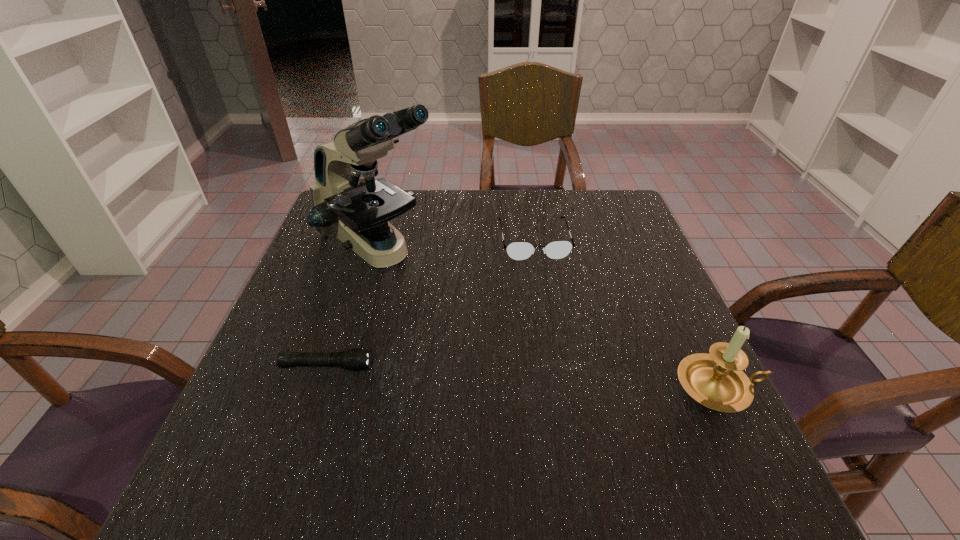
The width and height of the screenshot is (960, 540). Find the location of `free spot between the third tallest object and the microscope`. free spot between the third tallest object and the microscope is located at coordinates (455, 245).

Where is `vacant space in between the tallest object and the second shortest object`? vacant space in between the tallest object and the second shortest object is located at coordinates [455, 245].

I want to click on free space between the second shortest object and the microscope, so click(455, 245).

The width and height of the screenshot is (960, 540). Find the location of `free spot between the microscope and the second object from right to left`. free spot between the microscope and the second object from right to left is located at coordinates (455, 245).

Identify the location of unoccupied position between the third tallest object and the flashlight. (430, 303).

Identify the location of blank region between the microscope and the spectacles. The width and height of the screenshot is (960, 540). (455, 245).

At what (x,y) coordinates should I click in order to perform the action: click on empty space between the flashlight and the tallest object. Please return your answer as a coordinate pair (x, y). This screenshot has height=540, width=960. Looking at the image, I should click on (351, 308).

This screenshot has height=540, width=960. I want to click on free space between the spectacles and the tallest object, so click(x=455, y=245).

Find the location of a particular element. The height and width of the screenshot is (540, 960). object that is the third closest to the second object from right to left is located at coordinates (355, 359).

You are a GUI agent. You are given a task and a screenshot of the screen. Output one action in this format:
    pyautogui.click(x=<x>, y=<y>)
    Task: Click on the object that is the second closest to the rightmost object
    The width and height of the screenshot is (960, 540).
    Given the screenshot: What is the action you would take?
    pyautogui.click(x=347, y=201)